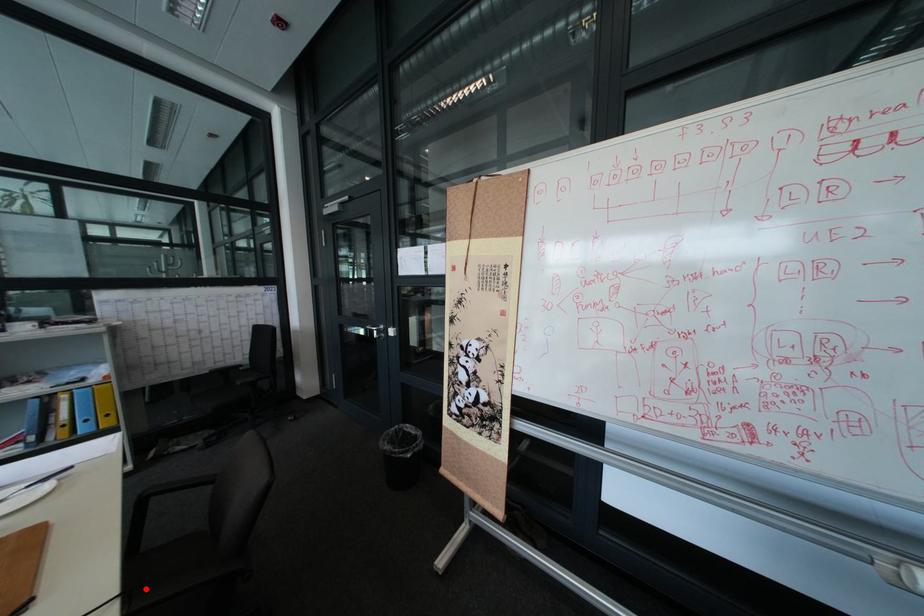
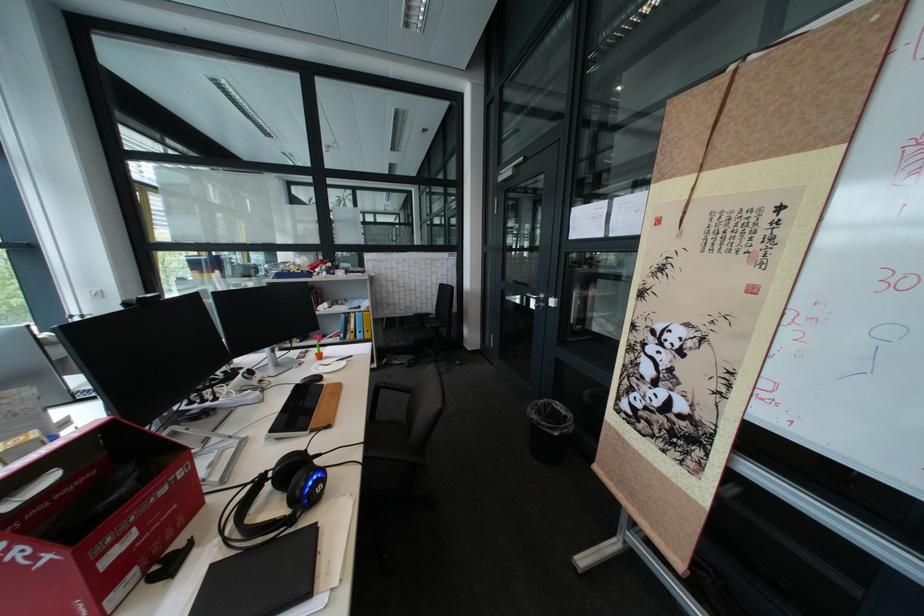
Find the pixel in the second image that matches the highlighted location in the first image.

(382, 443)